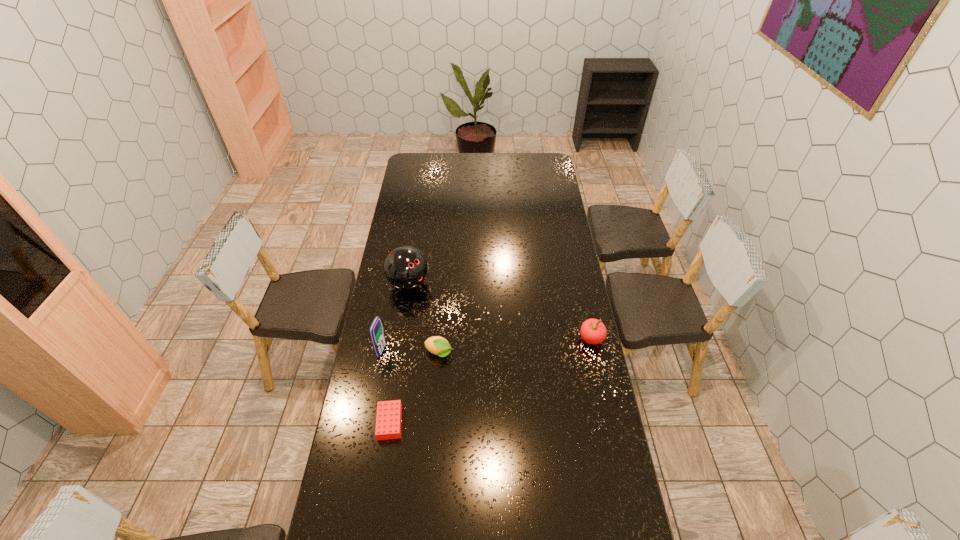
Find the location of `vacant region between the farthest object and the fourth tallest object`. vacant region between the farthest object and the fourth tallest object is located at coordinates (424, 318).

Where is `vacant space that's between the fourth tallest object and the bowling ball`? The width and height of the screenshot is (960, 540). vacant space that's between the fourth tallest object and the bowling ball is located at coordinates (424, 318).

Identify the location of free space between the third shortest object and the farthest object. This screenshot has height=540, width=960. (500, 311).

Identify the location of vacant region between the shortest object and the cellular telephone. (386, 387).

Image resolution: width=960 pixels, height=540 pixels. Identify the location of vacant space that is in between the cellular telephone and the bowling ball. (396, 317).

The image size is (960, 540). Find the location of `vacant space in between the second object from right to left and the cellular telephone`. vacant space in between the second object from right to left and the cellular telephone is located at coordinates (411, 352).

Image resolution: width=960 pixels, height=540 pixels. In order to click on vacant area that lies between the second shortest object and the nearest object in this screenshot , I will do `click(415, 388)`.

Locate an element on the screen. This screenshot has width=960, height=540. free point between the lemon and the cellular telephone is located at coordinates (411, 352).

Identify which object is the nearest to the apple. Please provide its 2D coordinates. Your answer should be formatted as a tuple, i.e. [(x, y)], where the tuple contains the x and y coordinates of a point satisfying the conditions above.

[(437, 345)]

Where is `object that is the fourth closest one to the nearest object`? The image size is (960, 540). object that is the fourth closest one to the nearest object is located at coordinates (593, 331).